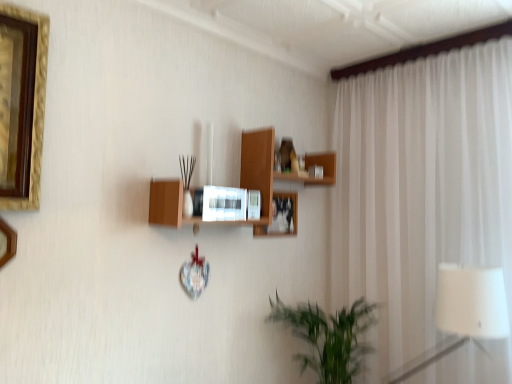
What do you see at coordinates (274, 172) in the screenshot? I see `wooden microwave at center` at bounding box center [274, 172].

Where is `matte white picture frame at center, the second picture frame in the front-to-back sequence`? matte white picture frame at center, the second picture frame in the front-to-back sequence is located at coordinates (224, 204).

Identify the location of gold-framed picture at left, placed as the first picture frame when sorted from front to back. This screenshot has height=384, width=512. (7, 243).

Find the location of `wooden microwave at center`. wooden microwave at center is located at coordinates (274, 172).

Which object is positioned more to the left, white sheer curtain at right or matte white picture frame at center, the 1th picture frame in the right-to-left sequence?

matte white picture frame at center, the 1th picture frame in the right-to-left sequence.

Which object is further away from the camera, white sheer curtain at right or matte white picture frame at center, placed as the 2th picture frame when sorted from left to right?

matte white picture frame at center, placed as the 2th picture frame when sorted from left to right, is further away from the camera.

Looking at their sizes, would you say white sheer curtain at right is wider or thinner than matte white picture frame at center, the 1th picture frame in the right-to-left sequence?

white sheer curtain at right is wider than matte white picture frame at center, the 1th picture frame in the right-to-left sequence.

Can you confirm if white sheer curtain at right is shorter than matte white picture frame at center, placed as the 2th picture frame when sorted from left to right?

No, white sheer curtain at right is not shorter than matte white picture frame at center, placed as the 2th picture frame when sorted from left to right.

Is green leafy plant at lower center wider or thinner than white sheer curtain at right?

Clearly, green leafy plant at lower center has more width compared to white sheer curtain at right.

Which object is more forward, green leafy plant at lower center or white sheer curtain at right?

white sheer curtain at right is in front.

From a real-world perspective, between green leafy plant at lower center and white sheer curtain at right, who is vertically higher?

white sheer curtain at right is physically above.

Is green leafy plant at lower center not near white sheer curtain at right?

They are positioned close to each other.

Would you say wooden microwave at center is a long distance from matte white picture frame at center, the second picture frame in the front-to-back sequence?

No, wooden microwave at center is in close proximity to matte white picture frame at center, the second picture frame in the front-to-back sequence.

In the image, is wooden microwave at center positioned in front of or behind matte white picture frame at center, positioned as the 1th picture frame in back-to-front order?

In the image, wooden microwave at center appears in front of matte white picture frame at center, positioned as the 1th picture frame in back-to-front order.

Which is more to the left, wooden microwave at center or matte white picture frame at center, the 1th picture frame in the right-to-left sequence?

matte white picture frame at center, the 1th picture frame in the right-to-left sequence, is more to the left.

Is matte white picture frame at center, placed as the 2th picture frame when sorted from left to right, at the back of wooden microwave at center?

Yes, wooden microwave at center is positioned with its back facing matte white picture frame at center, placed as the 2th picture frame when sorted from left to right.

Which object is thinner, white sheer curtain at right or gold-framed picture at left, which ranks as the 2th picture frame in back-to-front order?

Thinner between the two is gold-framed picture at left, which ranks as the 2th picture frame in back-to-front order.

Could gold-framed picture at left, placed as the first picture frame when sorted from front to back, be considered to be inside white sheer curtain at right?

No, gold-framed picture at left, placed as the first picture frame when sorted from front to back, is not inside white sheer curtain at right.

Is white sheer curtain at right positioned behind gold-framed picture at left, which is the second picture frame in right-to-left order?

Yes, the depth of white sheer curtain at right is greater than that of gold-framed picture at left, which is the second picture frame in right-to-left order.

Does white sheer curtain at right appear on the left side of gold-framed picture at left, which is the second picture frame in right-to-left order?

In fact, white sheer curtain at right is to the right of gold-framed picture at left, which is the second picture frame in right-to-left order.

Consider the image. From the image's perspective, is wooden microwave at center below white sheer curtain at right?

No.

Is wooden microwave at center oriented away from white sheer curtain at right?

No.

From a real-world perspective, is wooden microwave at center physically located above or below white sheer curtain at right?

wooden microwave at center is above white sheer curtain at right.

This screenshot has height=384, width=512. I want to click on shelf lying on the left of white sheer curtain at right, so click(x=274, y=172).

What's the angular difference between gold-framed picture at left, which is the second picture frame in right-to-left order, and green leafy plant at lower center's facing directions?

The angular difference between gold-framed picture at left, which is the second picture frame in right-to-left order, and green leafy plant at lower center is 2.12 degrees.

From the image's perspective, does gold-framed picture at left, placed as the first picture frame when sorted from front to back, appear lower than green leafy plant at lower center?

No.

Consider the image. Considering the sizes of gold-framed picture at left, placed as the first picture frame when sorted from front to back, and green leafy plant at lower center in the image, is gold-framed picture at left, placed as the first picture frame when sorted from front to back, taller or shorter than green leafy plant at lower center?

Considering their sizes, gold-framed picture at left, placed as the first picture frame when sorted from front to back, has less height than green leafy plant at lower center.

Is green leafy plant at lower center located within gold-framed picture at left, which is the second picture frame in right-to-left order?

No, green leafy plant at lower center is not inside gold-framed picture at left, which is the second picture frame in right-to-left order.

Is point (3, 254) more distant than point (233, 201)?

No, it is in front of (233, 201).

Consider the image. Between gold-framed picture at left, placed as the first picture frame when sorted from front to back, and matte white picture frame at center, positioned as the 1th picture frame in back-to-front order, which one has less height?

Standing shorter between the two is matte white picture frame at center, positioned as the 1th picture frame in back-to-front order.

Looking at this image, is gold-framed picture at left, which is the second picture frame in right-to-left order, oriented away from matte white picture frame at center, positioned as the 1th picture frame in back-to-front order?

No, matte white picture frame at center, positioned as the 1th picture frame in back-to-front order, is not at the back of gold-framed picture at left, which is the second picture frame in right-to-left order.

The image size is (512, 384). In order to click on picture frame located behind the gold-framed picture at left, which is the second picture frame in right-to-left order in this screenshot , I will do `click(224, 204)`.

This screenshot has height=384, width=512. I want to click on picture frame above the white sheer curtain at right (from a real-world perspective), so click(x=224, y=204).

Identify the location of houseplant that is below the white sheer curtain at right (from the image's perspective). (329, 337).

Looking at the image, which one is located further to green leafy plant at lower center, gold-framed picture at left, marked as the 1th picture frame in a left-to-right arrangement, or matte white picture frame at center, placed as the 2th picture frame when sorted from left to right?

Based on the image, gold-framed picture at left, marked as the 1th picture frame in a left-to-right arrangement, appears to be further to green leafy plant at lower center.

From the image, which object appears to be farther from matte white picture frame at center, the 1th picture frame in the right-to-left sequence, wooden microwave at center or green leafy plant at lower center?

Among the two, green leafy plant at lower center is located further to matte white picture frame at center, the 1th picture frame in the right-to-left sequence.

Based on the photo, looking at the image, which one is located further to matte white picture frame at center, placed as the 2th picture frame when sorted from left to right, green leafy plant at lower center or white sheer curtain at right?

Among the two, white sheer curtain at right is located further to matte white picture frame at center, placed as the 2th picture frame when sorted from left to right.

Looking at the image, which one is located closer to green leafy plant at lower center, gold-framed picture at left, placed as the first picture frame when sorted from front to back, or white fabric lampshade at right?

white fabric lampshade at right is positioned closer to the anchor green leafy plant at lower center.

Considering their positions, is matte white picture frame at center, positioned as the 1th picture frame in back-to-front order, positioned closer to white fabric lampshade at right than white sheer curtain at right?

The object closer to white fabric lampshade at right is white sheer curtain at right.

Based on their spatial positions, is white sheer curtain at right or matte white picture frame at center, the second picture frame in the front-to-back sequence, closer to gold-framed picture at left, which ranks as the 2th picture frame in back-to-front order?

The object closer to gold-framed picture at left, which ranks as the 2th picture frame in back-to-front order, is matte white picture frame at center, the second picture frame in the front-to-back sequence.

Considering their positions, is white fabric lampshade at right positioned further to matte white picture frame at center, positioned as the 1th picture frame in back-to-front order, than wooden microwave at center?

The object further to matte white picture frame at center, positioned as the 1th picture frame in back-to-front order, is white fabric lampshade at right.

Looking at the image, which one is located closer to gold-framed picture at left, placed as the first picture frame when sorted from front to back, white sheer curtain at right or green leafy plant at lower center?

green leafy plant at lower center is closer to gold-framed picture at left, placed as the first picture frame when sorted from front to back.

Where is `picture frame located between gold-framed picture at left, placed as the first picture frame when sorted from front to back, and white fabric lampshade at right in the left-right direction`? The image size is (512, 384). picture frame located between gold-framed picture at left, placed as the first picture frame when sorted from front to back, and white fabric lampshade at right in the left-right direction is located at coordinates (224, 204).

Find the location of `shelf located between gold-framed picture at left, which ranks as the 2th picture frame in back-to-front order, and white fabric lampshade at right in the left-right direction`. shelf located between gold-framed picture at left, which ranks as the 2th picture frame in back-to-front order, and white fabric lampshade at right in the left-right direction is located at coordinates (274, 172).

Where is `picture frame located between gold-framed picture at left, which is the second picture frame in right-to-left order, and green leafy plant at lower center in the left-right direction`? picture frame located between gold-framed picture at left, which is the second picture frame in right-to-left order, and green leafy plant at lower center in the left-right direction is located at coordinates (224, 204).

Image resolution: width=512 pixels, height=384 pixels. I want to click on shelf between matte white picture frame at center, the 1th picture frame in the right-to-left sequence, and white fabric lampshade at right, so click(x=274, y=172).